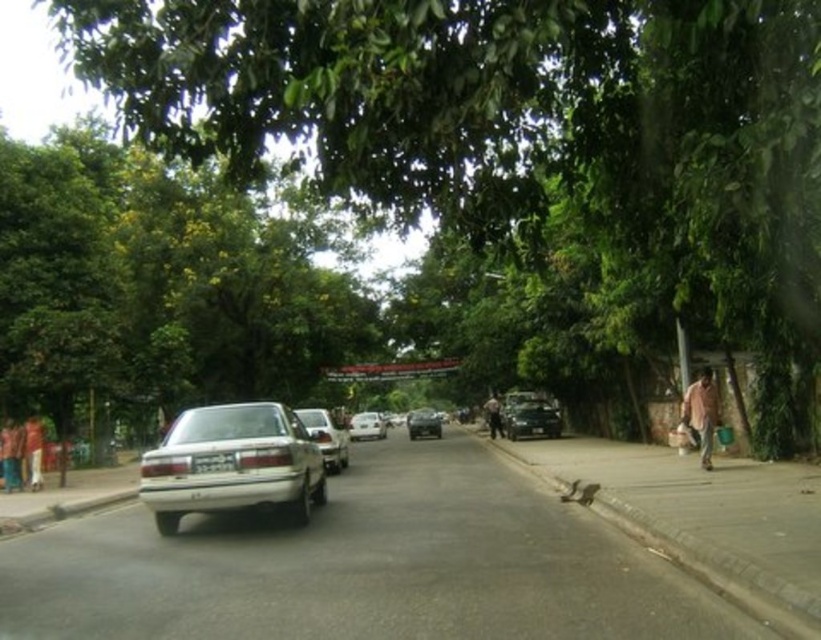
Question: Is green leafy tree at center bigger than shiny black car at right?

Choices:
 (A) yes
 (B) no

Answer: (A)

Question: Which of the following is the closest to the observer?

Choices:
 (A) (544, 404)
 (B) (374, 412)
 (C) (320, 417)
 (D) (175, 490)

Answer: (D)

Question: Is matte pink shirt at left to the right of white matte car at center from the viewer's perspective?

Choices:
 (A) yes
 (B) no

Answer: (B)

Question: Among these objects, which one is farthest from the camera?

Choices:
 (A) white matte car at center
 (B) brown leather jacket at center
 (C) green leafy tree at center

Answer: (A)

Question: Can you confirm if green leafy tree at center is smaller than brown leather jacket at center?

Choices:
 (A) no
 (B) yes

Answer: (A)

Question: Which object appears closest to the camera in this image?

Choices:
 (A) brown leather jacket at center
 (B) matte pink shirt at left
 (C) green leafy tree at center

Answer: (C)